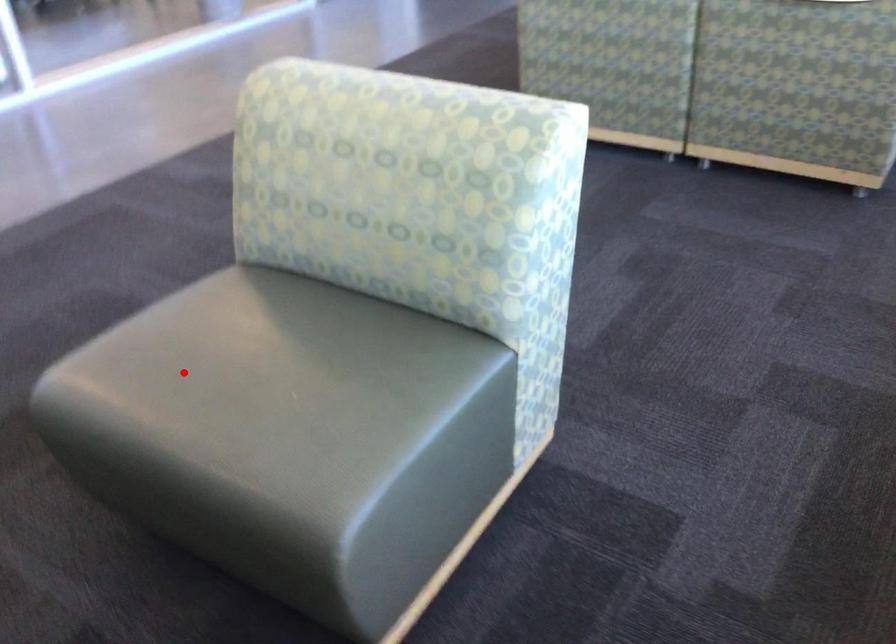
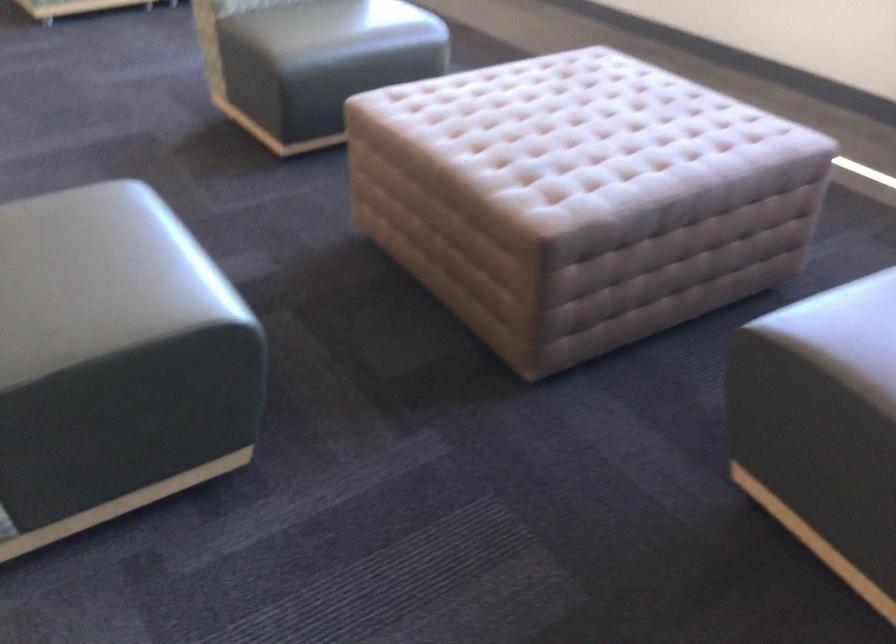
Locate, in the second image, the point that corresponds to the highlighted location in the first image.

(334, 26)